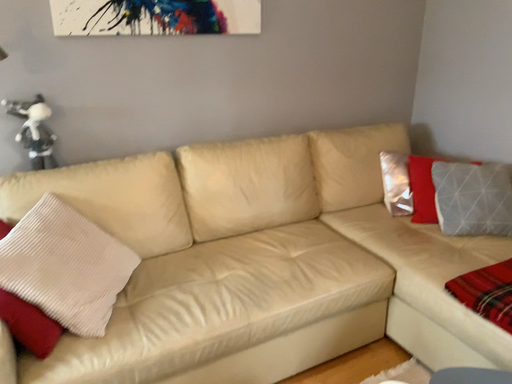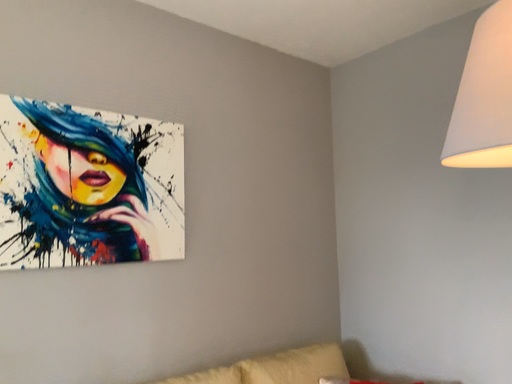
Question: Which way did the camera rotate in the video?

Choices:
 (A) rotated left
 (B) rotated right

Answer: (B)